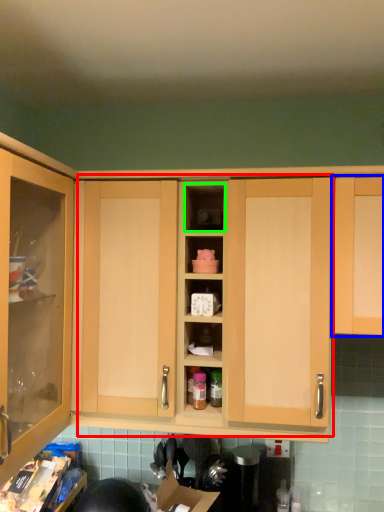
Question: Estimate the real-world distances between objects in this image. Which object is closer to dresser (highlighted by a red box), cabinetry (highlighted by a blue box) or cabinet (highlighted by a green box)?

Choices:
 (A) cabinetry
 (B) cabinet

Answer: (A)